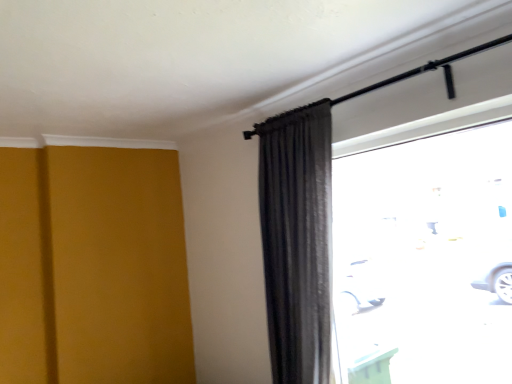
I want to click on satin gray curtain at upper right, so click(296, 239).

What do you see at coordinates (296, 239) in the screenshot?
I see `satin gray curtain at upper right` at bounding box center [296, 239].

Identify the location of satin gray curtain at upper right. The image size is (512, 384). click(296, 239).